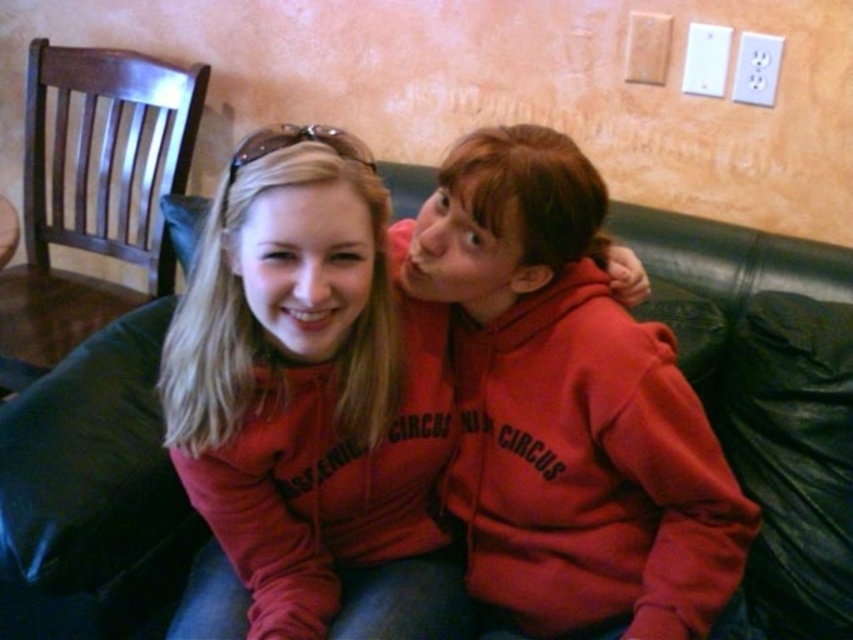
Which is more to the right, black leather couch at center or matte red sweatshirt at center?

black leather couch at center is more to the right.

Is black leather couch at center positioned in front of matte red sweatshirt at center?

No.

Between point (814, 513) and point (234, 442), which one is positioned in front?

Point (234, 442)

Identify the location of black leather couch at center. This screenshot has width=853, height=640. (766, 396).

Can you confirm if black leather couch at center is shorter than matte red hoodie at center?

No, black leather couch at center is not shorter than matte red hoodie at center.

Who is higher up, black leather couch at center or matte red hoodie at center?

Positioned higher is black leather couch at center.

Is point (677, 280) positioned after point (427, 275)?

Yes, point (677, 280) is farther from viewer.

Image resolution: width=853 pixels, height=640 pixels. I want to click on black leather couch at center, so click(766, 396).

Is matte red hoodie at center to the right of matte red sweatshirt at center from the viewer's perspective?

Indeed, matte red hoodie at center is positioned on the right side of matte red sweatshirt at center.

The image size is (853, 640). What do you see at coordinates (569, 406) in the screenshot? I see `matte red hoodie at center` at bounding box center [569, 406].

Where is `matte red hoodie at center`? matte red hoodie at center is located at coordinates (569, 406).